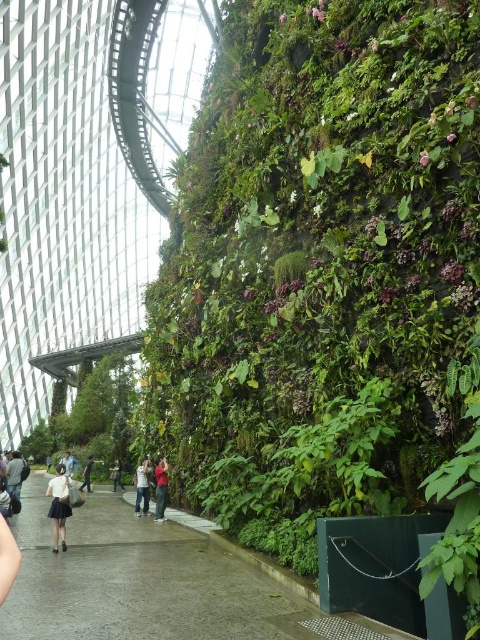
Which is above, matte red shirt at center or dark blue jeans at center?

matte red shirt at center is above.

Does matte red shirt at center appear on the right side of dark blue jeans at center?

Correct, you'll find matte red shirt at center to the right of dark blue jeans at center.

Does point (157, 486) come farther from viewer compared to point (84, 468)?

No, (157, 486) is in front of (84, 468).

Locate an element on the screen. matte red shirt at center is located at coordinates (160, 486).

Does point (137, 513) come behind point (88, 472)?

That is False.

Which is behind, point (144, 470) or point (87, 460)?

Point (87, 460)

Who is more distant from viewer, (147, 474) or (84, 481)?

The point (84, 481) is behind.

Where is `white cotton shirt at center`? This screenshot has width=480, height=640. white cotton shirt at center is located at coordinates 142,486.

Which is below, white matte skirt at lower left or dark blue jeans at center?

dark blue jeans at center is below.

From the picture: Does white matte skirt at lower left appear over dark blue jeans at center?

Yes.

Find the location of a particular element. white matte skirt at lower left is located at coordinates (59, 506).

At what (x,y) coordinates should I click in order to perform the action: click on white matte skirt at lower left. Please return your answer as a coordinate pair (x, y). The height and width of the screenshot is (640, 480). Looking at the image, I should click on (59, 506).